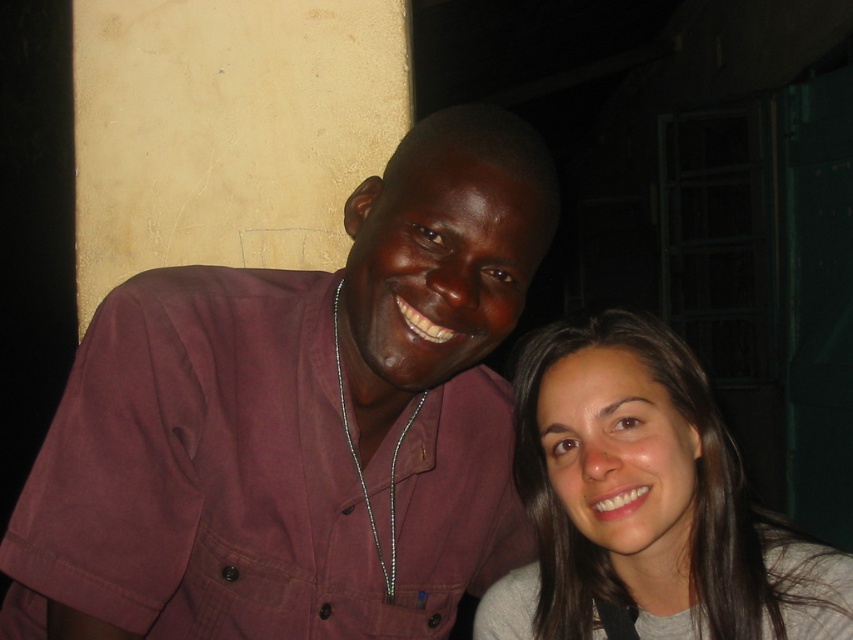
Question: Does maroon shirt at center have a larger size compared to smooth gray sweater at right?

Choices:
 (A) no
 (B) yes

Answer: (B)

Question: Does maroon shirt at center come in front of smooth gray sweater at right?

Choices:
 (A) yes
 (B) no

Answer: (A)

Question: Among these points, which one is farthest from the camera?

Choices:
 (A) (676, 532)
 (B) (219, 428)

Answer: (A)

Question: Does maroon shirt at center come in front of smooth gray sweater at right?

Choices:
 (A) no
 (B) yes

Answer: (B)